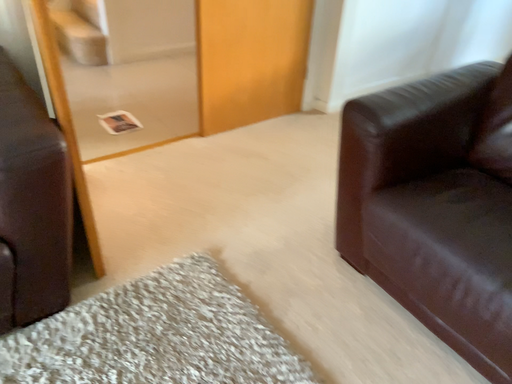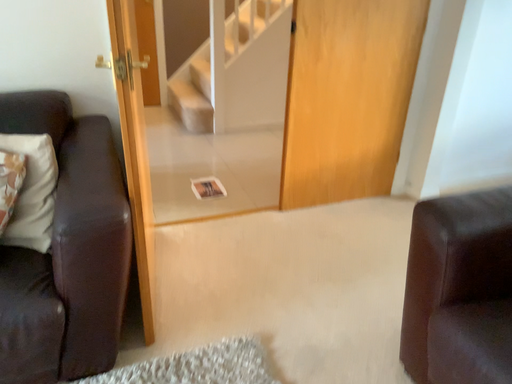
Question: Which way did the camera rotate in the video?

Choices:
 (A) rotated downward
 (B) rotated upward

Answer: (B)